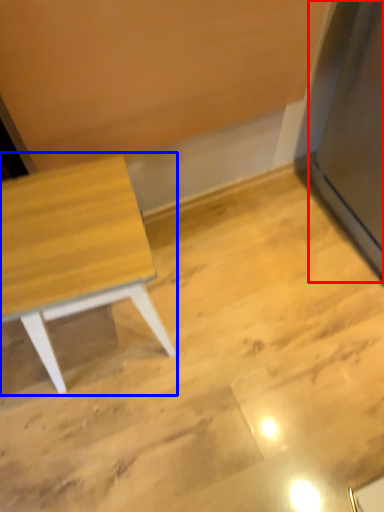
Question: Which object is further to the camera taking this photo, fridge (highlighted by a red box) or table (highlighted by a blue box)?

Choices:
 (A) fridge
 (B) table

Answer: (B)